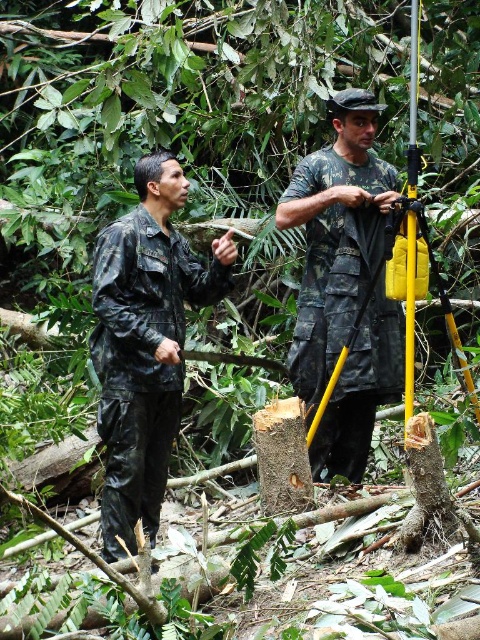
You are a hiker trying to identify clothing items in the image. Which clothing item is bigger in size between the matte black uniform at center and the camouflage fabric shirt at center?

The matte black uniform at center is larger in size than the camouflage fabric shirt at center.

You are a hiker trying to identify the two people in the forest. According to the image, which clothing item is located below the other between the matte black uniform at center and the camouflage fabric shirt at center?

The matte black uniform at center is positioned under the camouflage fabric shirt at center, so the matte black uniform at center is below the camouflage fabric shirt at center.